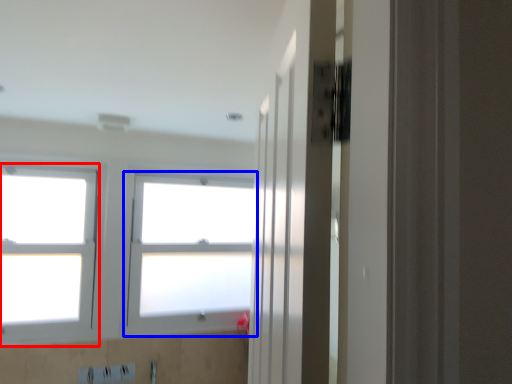
Question: Which object is closer to the camera taking this photo, window (highlighted by a red box) or window (highlighted by a blue box)?

Choices:
 (A) window
 (B) window

Answer: (A)